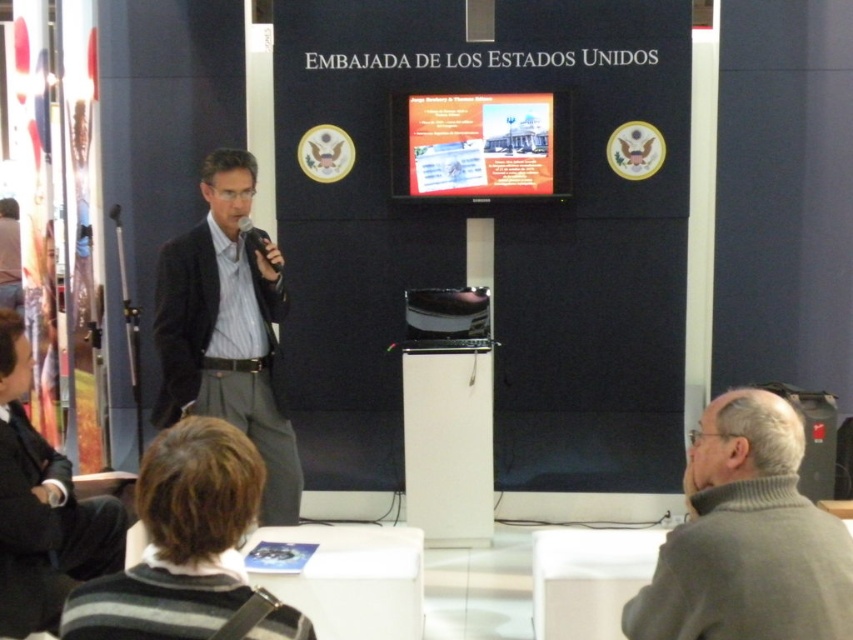
Which is more to the right, gray wool sweater at lower right or black plastic microphone at center?

From the viewer's perspective, gray wool sweater at lower right appears more on the right side.

Is the position of gray wool sweater at lower right more distant than that of black plastic microphone at center?

No.

Is point (780, 490) positioned before point (273, 268)?

Yes, point (780, 490) is closer to viewer.

You are a GUI agent. You are given a task and a screenshot of the screen. Output one action in this format:
    pyautogui.click(x=<x>, y=<y>)
    Task: Click on the gray wool sweater at lower right
    This screenshot has height=640, width=853.
    Given the screenshot: What is the action you would take?
    pyautogui.click(x=747, y=538)

Is matte black suit at center to the right of black plastic microphone at center from the viewer's perspective?

In fact, matte black suit at center is to the left of black plastic microphone at center.

Measure the distance between matte black suit at center and camera.

A distance of 9.88 feet exists between matte black suit at center and camera.

What do you see at coordinates (225, 330) in the screenshot? This screenshot has width=853, height=640. I see `matte black suit at center` at bounding box center [225, 330].

Locate an element on the screen. matte black suit at center is located at coordinates (225, 330).

Is gray wool sweater at lower right closer to camera compared to black fabric business suit at lower left?

Yes, gray wool sweater at lower right is in front of black fabric business suit at lower left.

Is gray wool sweater at lower right taller than black fabric business suit at lower left?

No.

The height and width of the screenshot is (640, 853). What do you see at coordinates (747, 538) in the screenshot?
I see `gray wool sweater at lower right` at bounding box center [747, 538].

I want to click on gray wool sweater at lower right, so click(747, 538).